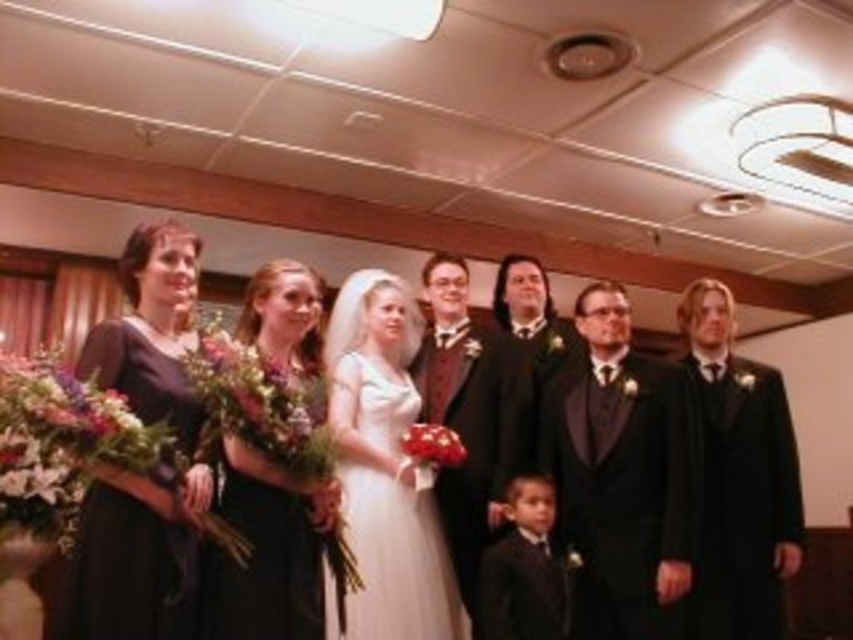
Can you confirm if matte black suit at center is bigger than matte black dresses at left?

Correct, matte black suit at center is larger in size than matte black dresses at left.

Measure the distance from matte black suit at center to matte black dresses at left.

matte black suit at center and matte black dresses at left are 9.88 feet apart.

Where is `matte black suit at center`? matte black suit at center is located at coordinates (519, 368).

Is white satin dress at center below matte black dresses at left?

Correct, white satin dress at center is located below matte black dresses at left.

Who is higher up, white satin dress at center or matte black dresses at left?

matte black dresses at left is above.

Which is behind, point (380, 618) or point (54, 288)?

The point (54, 288) is more distant.

This screenshot has width=853, height=640. Find the location of `white satin dress at center`. white satin dress at center is located at coordinates (386, 468).

Between point (277, 284) and point (474, 371), which one is positioned in front?

Point (277, 284) is more forward.

Is point (274, 316) positioned before point (426, 307)?

Yes.

At what (x,y) coordinates should I click in order to perform the action: click on black satin dress at center. Please return your answer as a coordinate pair (x, y). The height and width of the screenshot is (640, 853). Looking at the image, I should click on (270, 550).